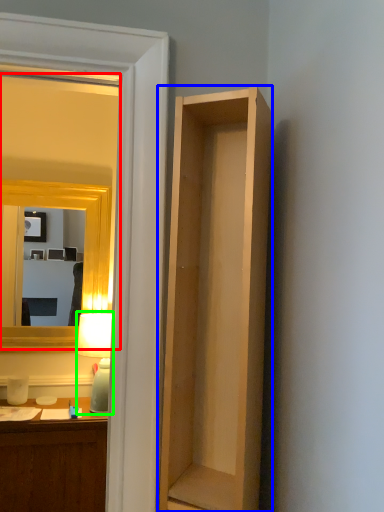
Question: Estimate the real-world distances between objects in this image. Which object is farther from mirror (highlighted by a red box), cabinetry (highlighted by a blue box) or lamp (highlighted by a green box)?

Choices:
 (A) cabinetry
 (B) lamp

Answer: (A)